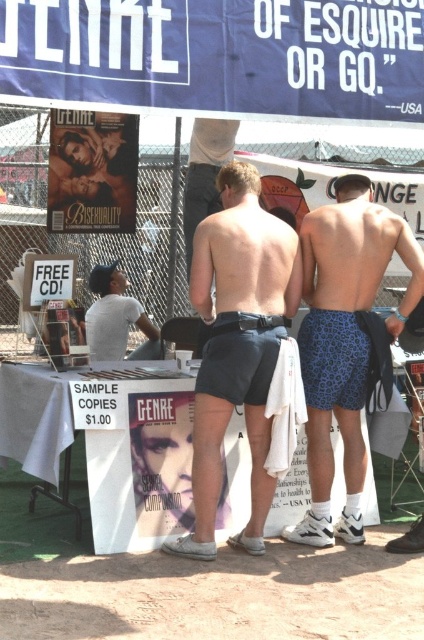
Is matte black shorts at center taller than white fabric shorts at center?

Indeed, matte black shorts at center has a greater height compared to white fabric shorts at center.

Between point (223, 145) and point (296, 355), which one is positioned in front?

Point (296, 355) is in front.

This screenshot has height=640, width=424. Find the location of `matte black shorts at center`. matte black shorts at center is located at coordinates (204, 173).

Which is below, blue fabric canopy at upper center or matte black shorts at center?

matte black shorts at center is lower down.

Does point (360, 48) lie in front of point (192, 129)?

Yes.

This screenshot has width=424, height=640. Identify the location of blue fabric canopy at upper center. (217, 56).

Which of these two, blue leopard print shorts at center or white t-shirt at center, stands shorter?

white t-shirt at center

Between blue leopard print shorts at center and white t-shirt at center, which one is positioned higher?

white t-shirt at center

Is point (359, 467) closer to viewer compared to point (103, 305)?

Yes, it is in front of point (103, 305).

Find the location of `blue leopard print shorts at center`. blue leopard print shorts at center is located at coordinates (343, 340).